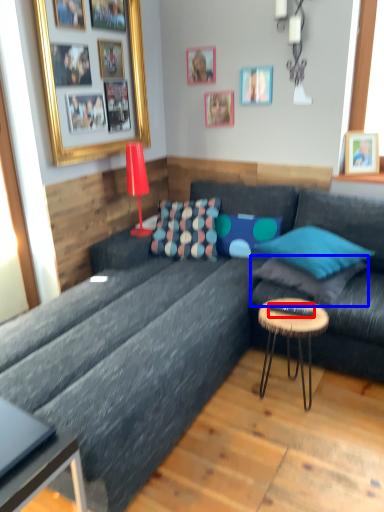
Question: Which point is closer to the camera, remote control (highlighted by a red box) or pillow (highlighted by a blue box)?

Choices:
 (A) remote control
 (B) pillow

Answer: (A)